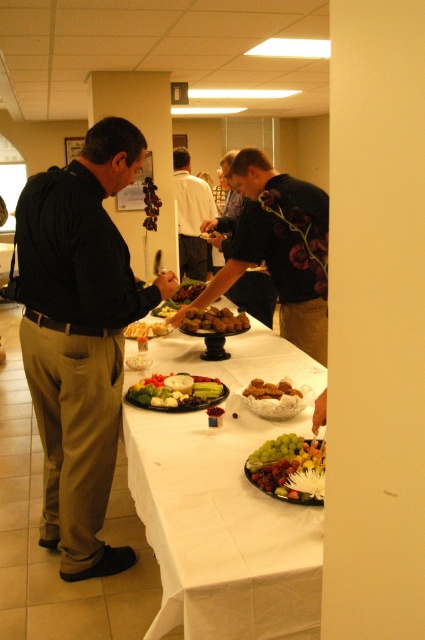
What do you see at coordinates (224, 500) in the screenshot? I see `white cloth at center` at bounding box center [224, 500].

Where is `white cloth at center`? The height and width of the screenshot is (640, 425). white cloth at center is located at coordinates (224, 500).

Locate an element on the screen. The image size is (425, 640). white cloth at center is located at coordinates (224, 500).

Describe the element at coordinates (190, 216) in the screenshot. I see `white shirt at center` at that location.

The height and width of the screenshot is (640, 425). I want to click on white shirt at center, so click(x=190, y=216).

Which of these two, dark brown shirt at left or white shirt at center, stands taller?

Standing taller between the two is dark brown shirt at left.

Is point (102, 348) positioned behind point (193, 243)?

No, (102, 348) is closer to viewer.

The height and width of the screenshot is (640, 425). In order to click on dark brown shirt at left in this screenshot , I will do `click(79, 337)`.